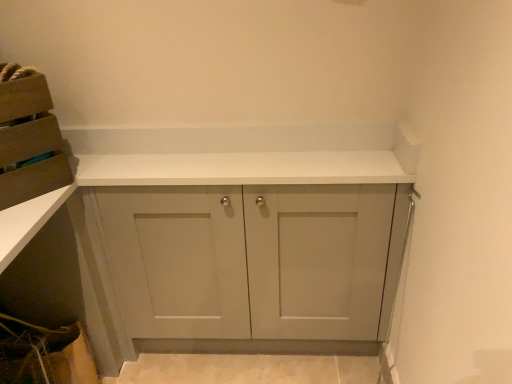
Identify the location of vacant space situated above white matte cabinet at center, positioned as the second cabinetry in left-to-right order (from a real-world perspective). (225, 162).